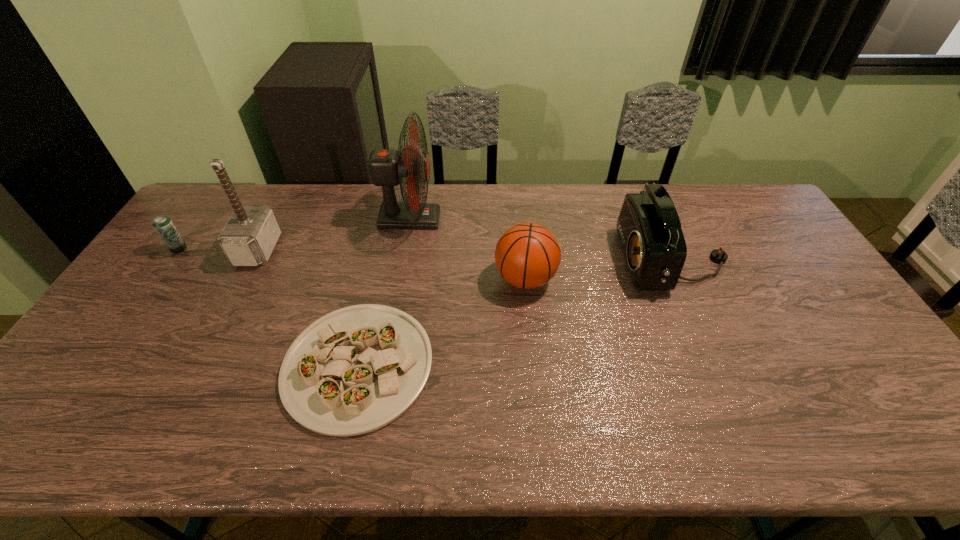
Identify the location of vacant area that lies between the basketball and the radio receiver. (600, 270).

At what (x,y) coordinates should I click in order to perform the action: click on vacant area between the shortest object and the second shortest object. Please return your answer as a coordinate pair (x, y). The height and width of the screenshot is (540, 960). Looking at the image, I should click on (269, 307).

What are the coordinates of `free space between the rightmost object and the fifth object from left to right` in the screenshot? It's located at (600, 270).

Where is `empty space between the leftmost object and the second object from left to right`? empty space between the leftmost object and the second object from left to right is located at coordinates (219, 249).

Image resolution: width=960 pixels, height=540 pixels. Identify the location of vacant point located between the shortest object and the basketball. (442, 322).

Identify the location of free spot between the second shortest object and the fifth object from right to left. (219, 249).

Locate which object is the third closest to the leftmost object. Please provide its 2D coordinates. Your answer should be formatted as a tuple, i.e. [(x, y)], where the tuple contains the x and y coordinates of a point satisfying the conditions above.

[(387, 167)]

You are a GUI agent. You are given a task and a screenshot of the screen. Output one action in this format:
    pyautogui.click(x=<x>, y=<y>)
    Task: Click on the fourth closest object to the fan
    The height and width of the screenshot is (540, 960).
    Given the screenshot: What is the action you would take?
    pyautogui.click(x=649, y=230)

Where is `free location that satisfies the following two spatial constraints: 1. on the front-facing side of the third shortest object; 2. on the right side of the fan`? free location that satisfies the following two spatial constraints: 1. on the front-facing side of the third shortest object; 2. on the right side of the fan is located at coordinates (399, 279).